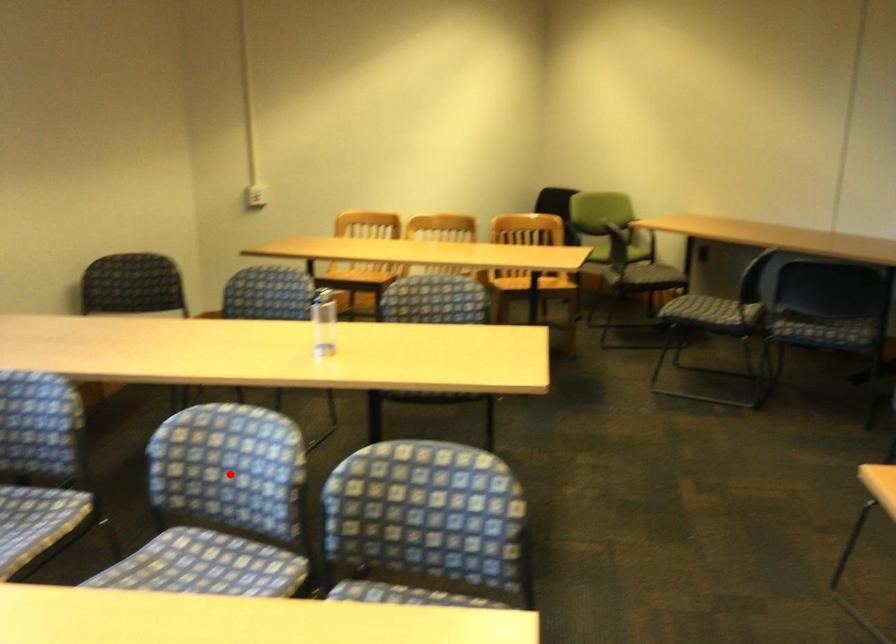
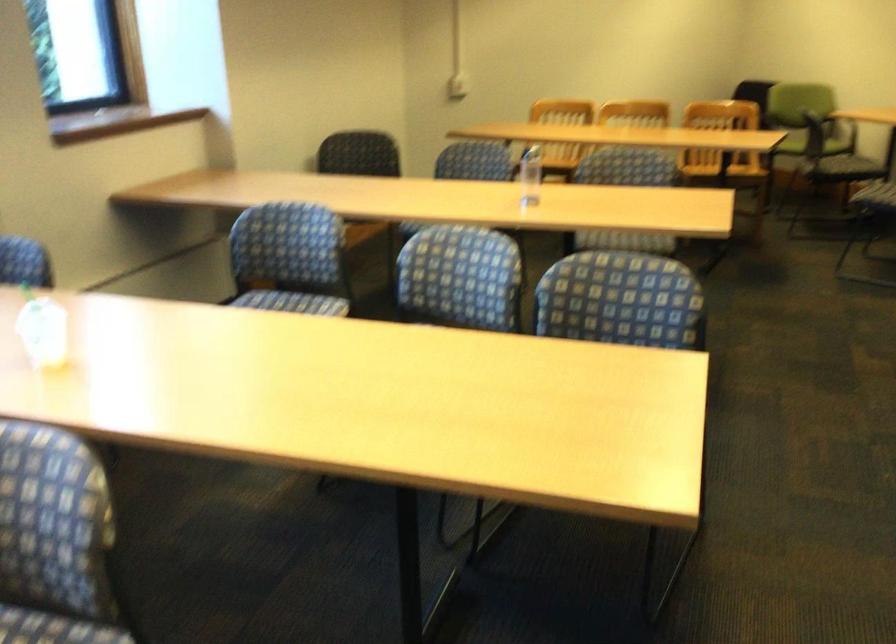
Locate, in the second image, the point that corresponds to the highlighted location in the first image.

(460, 277)